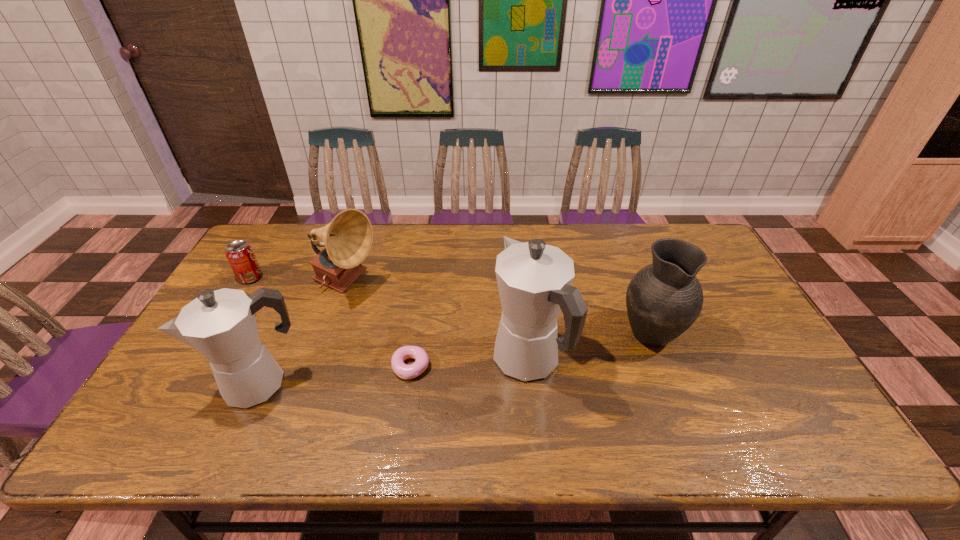
Please point a spot on the right to add another coffeepot. Please provide its 2D coordinates. Your answer should be formatted as a tuple, i.e. [(x, y)], where the tuple contains the x and y coordinates of a point satisfying the conditions above.

[(772, 340)]